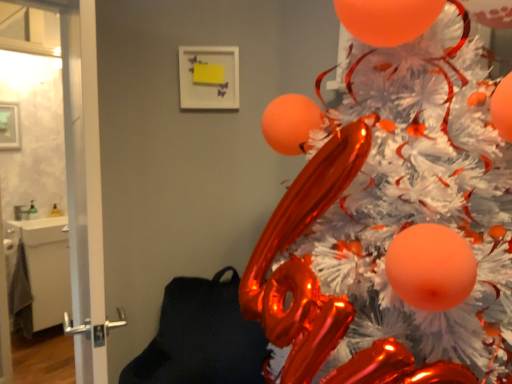
Describe the element at coordinates (396, 224) in the screenshot. Image resolution: width=512 pixels, height=384 pixels. I see `shiny metallic christmas tree at upper right` at that location.

In order to face transparent glass door at left, which is counted as the 2th screen door, starting from the left, should I rotate leftwards or rightwards?

You should look left and rotate roughly 22.150 degrees.

This screenshot has width=512, height=384. What are the coordinates of `transparent glass door at left, placed as the first screen door when sorted from right to left` in the screenshot? It's located at (84, 186).

Where is `white glossy door at left, positioned as the 1th screen door in left-to-right order`? Image resolution: width=512 pixels, height=384 pixels. white glossy door at left, positioned as the 1th screen door in left-to-right order is located at coordinates (82, 156).

Can you tell me how much transparent glass door at left, placed as the first screen door when sorted from right to left, and white glossy door at left, positioned as the 1th screen door in left-to-right order, differ in facing direction?

They differ by 114 degrees in their facing directions.

Considering the relative positions of transparent glass door at left, placed as the first screen door when sorted from right to left, and white glossy door at left, marked as the 2th screen door in a right-to-left arrangement, in the image provided, is transparent glass door at left, placed as the first screen door when sorted from right to left, to the left of white glossy door at left, marked as the 2th screen door in a right-to-left arrangement, from the viewer's perspective?

Incorrect, transparent glass door at left, placed as the first screen door when sorted from right to left, is not on the left side of white glossy door at left, marked as the 2th screen door in a right-to-left arrangement.

The image size is (512, 384). I want to click on screen door above the transparent glass door at left, placed as the first screen door when sorted from right to left (from a real-world perspective), so click(x=82, y=156).

Based on the photo, who is smaller, transparent glass door at left, which is counted as the 2th screen door, starting from the left, or white glossy door at left, marked as the 2th screen door in a right-to-left arrangement?

white glossy door at left, marked as the 2th screen door in a right-to-left arrangement, is smaller.

Is shiny metallic christmas tree at upper right in front of or behind transparent glass door at left, which is counted as the 2th screen door, starting from the left, in the image?

Visually, shiny metallic christmas tree at upper right is located in front of transparent glass door at left, which is counted as the 2th screen door, starting from the left.

Which point is more distant from viewer, (346, 189) or (86, 222)?

Point (86, 222)

Is the surface of shiny metallic christmas tree at upper right in direct contact with transparent glass door at left, which is counted as the 2th screen door, starting from the left?

No, shiny metallic christmas tree at upper right is not next to transparent glass door at left, which is counted as the 2th screen door, starting from the left.

Between shiny metallic christmas tree at upper right and white glossy door at left, marked as the 2th screen door in a right-to-left arrangement, which one has smaller width?

With smaller width is white glossy door at left, marked as the 2th screen door in a right-to-left arrangement.

From the image's perspective, is shiny metallic christmas tree at upper right above white glossy door at left, marked as the 2th screen door in a right-to-left arrangement?

Incorrect, from the image's perspective, shiny metallic christmas tree at upper right is lower than white glossy door at left, marked as the 2th screen door in a right-to-left arrangement.

Would you say shiny metallic christmas tree at upper right contains white glossy door at left, positioned as the 1th screen door in left-to-right order?

No, white glossy door at left, positioned as the 1th screen door in left-to-right order, is not inside shiny metallic christmas tree at upper right.

Who is taller, white glossy door at left, positioned as the 1th screen door in left-to-right order, or shiny metallic christmas tree at upper right?

Standing taller between the two is white glossy door at left, positioned as the 1th screen door in left-to-right order.

How different are the orientations of white glossy door at left, marked as the 2th screen door in a right-to-left arrangement, and shiny metallic christmas tree at upper right in degrees?

87.5 degrees.

Considering the positions of objects white glossy door at left, positioned as the 1th screen door in left-to-right order, and shiny metallic christmas tree at upper right in the image provided, who is more to the left, white glossy door at left, positioned as the 1th screen door in left-to-right order, or shiny metallic christmas tree at upper right?

white glossy door at left, positioned as the 1th screen door in left-to-right order.

Could you tell me if white glossy door at left, positioned as the 1th screen door in left-to-right order, is facing shiny metallic christmas tree at upper right?

Yes, white glossy door at left, positioned as the 1th screen door in left-to-right order, is oriented towards shiny metallic christmas tree at upper right.

Is white glossy door at left, positioned as the 1th screen door in left-to-right order, taller or shorter than transparent glass door at left, placed as the first screen door when sorted from right to left?

In the image, white glossy door at left, positioned as the 1th screen door in left-to-right order, appears to be shorter than transparent glass door at left, placed as the first screen door when sorted from right to left.

Is white glossy door at left, marked as the 2th screen door in a right-to-left arrangement, wider or thinner than transparent glass door at left, placed as the first screen door when sorted from right to left?

white glossy door at left, marked as the 2th screen door in a right-to-left arrangement, is thinner than transparent glass door at left, placed as the first screen door when sorted from right to left.

Does point (94, 69) come farther from viewer compared to point (92, 71)?

Yes, point (94, 69) is behind point (92, 71).

Is transparent glass door at left, placed as the first screen door when sorted from right to left, touching shiny metallic christmas tree at upper right?

There is a gap between transparent glass door at left, placed as the first screen door when sorted from right to left, and shiny metallic christmas tree at upper right.

From a real-world perspective, is transparent glass door at left, which is counted as the 2th screen door, starting from the left, positioned under shiny metallic christmas tree at upper right based on gravity?

Incorrect, from a real-world perspective, transparent glass door at left, which is counted as the 2th screen door, starting from the left, is higher than shiny metallic christmas tree at upper right.

Which is more to the left, transparent glass door at left, placed as the first screen door when sorted from right to left, or shiny metallic christmas tree at upper right?

From the viewer's perspective, transparent glass door at left, placed as the first screen door when sorted from right to left, appears more on the left side.

Considering the sizes of transparent glass door at left, placed as the first screen door when sorted from right to left, and shiny metallic christmas tree at upper right in the image, is transparent glass door at left, placed as the first screen door when sorted from right to left, wider or thinner than shiny metallic christmas tree at upper right?

Considering their sizes, transparent glass door at left, placed as the first screen door when sorted from right to left, looks slimmer than shiny metallic christmas tree at upper right.

In order to click on screen door located below the white glossy door at left, marked as the 2th screen door in a right-to-left arrangement (from the image's perspective) in this screenshot , I will do tap(84, 186).

Where is `screen door that is the 1st one above the shiny metallic christmas tree at upper right (from a real-world perspective)`? screen door that is the 1st one above the shiny metallic christmas tree at upper right (from a real-world perspective) is located at coordinates (84, 186).

Looking at the image, which one is located closer to transparent glass door at left, placed as the first screen door when sorted from right to left, shiny metallic christmas tree at upper right or white glossy door at left, marked as the 2th screen door in a right-to-left arrangement?

white glossy door at left, marked as the 2th screen door in a right-to-left arrangement, lies closer to transparent glass door at left, placed as the first screen door when sorted from right to left, than the other object.

Which object lies further to the anchor point shiny metallic christmas tree at upper right, transparent glass door at left, placed as the first screen door when sorted from right to left, or white glossy door at left, positioned as the 1th screen door in left-to-right order?

transparent glass door at left, placed as the first screen door when sorted from right to left, lies further to shiny metallic christmas tree at upper right than the other object.

Based on their spatial positions, is white glossy door at left, marked as the 2th screen door in a right-to-left arrangement, or shiny metallic christmas tree at upper right further from transparent glass door at left, placed as the first screen door when sorted from right to left?

shiny metallic christmas tree at upper right is further to transparent glass door at left, placed as the first screen door when sorted from right to left.

When comparing their distances from white glossy door at left, marked as the 2th screen door in a right-to-left arrangement, does transparent glass door at left, placed as the first screen door when sorted from right to left, or shiny metallic christmas tree at upper right seem closer?

transparent glass door at left, placed as the first screen door when sorted from right to left, lies closer to white glossy door at left, marked as the 2th screen door in a right-to-left arrangement, than the other object.

When comparing their distances from shiny metallic christmas tree at upper right, does white glossy door at left, positioned as the 1th screen door in left-to-right order, or transparent glass door at left, which is counted as the 2th screen door, starting from the left, seem closer?

white glossy door at left, positioned as the 1th screen door in left-to-right order, lies closer to shiny metallic christmas tree at upper right than the other object.

Looking at the image, which one is located closer to white glossy door at left, positioned as the 1th screen door in left-to-right order, shiny metallic christmas tree at upper right or transparent glass door at left, which is counted as the 2th screen door, starting from the left?

transparent glass door at left, which is counted as the 2th screen door, starting from the left, is positioned closer to the anchor white glossy door at left, positioned as the 1th screen door in left-to-right order.

Where is `screen door between white glossy door at left, positioned as the 1th screen door in left-to-right order, and shiny metallic christmas tree at upper right`? screen door between white glossy door at left, positioned as the 1th screen door in left-to-right order, and shiny metallic christmas tree at upper right is located at coordinates point(84,186).